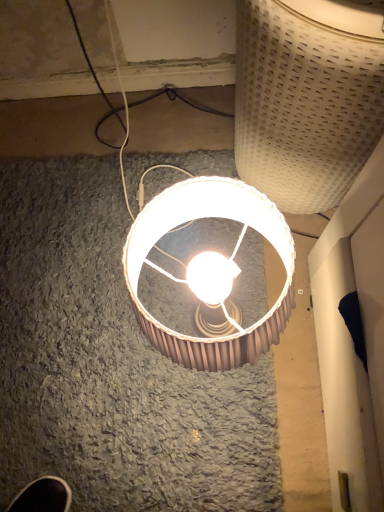
Question: Considering the positions of white woven basket at upper right, positioned as the first lamp in top-to-bottom order, and matte brown lampshade at center, the 2th lamp when ordered from top to bottom, in the image, is white woven basket at upper right, positioned as the first lamp in top-to-bottom order, wider or thinner than matte brown lampshade at center, the 2th lamp when ordered from top to bottom,?

Choices:
 (A) thin
 (B) wide

Answer: (B)

Question: In terms of size, does white woven basket at upper right, positioned as the first lamp in top-to-bottom order, appear bigger or smaller than matte brown lampshade at center, the 2th lamp when ordered from top to bottom?

Choices:
 (A) small
 (B) big

Answer: (B)

Question: Does point (276, 36) appear closer or farther from the camera than point (238, 355)?

Choices:
 (A) closer
 (B) farther

Answer: (B)

Question: Is matte brown lampshade at center, positioned as the first lamp in bottom-to-top order, in front of or behind white woven basket at upper right, arranged as the second lamp when ordered from the bottom, in the image?

Choices:
 (A) behind
 (B) front

Answer: (A)

Question: Looking at the image, does matte brown lampshade at center, the 2th lamp when ordered from top to bottom, seem bigger or smaller compared to white woven basket at upper right, arranged as the second lamp when ordered from the bottom?

Choices:
 (A) small
 (B) big

Answer: (A)

Question: Does point (213, 180) appear closer or farther from the camera than point (258, 162)?

Choices:
 (A) farther
 (B) closer

Answer: (B)

Question: Considering the relative positions of matte brown lampshade at center, positioned as the first lamp in bottom-to-top order, and white woven basket at upper right, positioned as the first lamp in top-to-bottom order, in the image provided, is matte brown lampshade at center, positioned as the first lamp in bottom-to-top order, to the left or to the right of white woven basket at upper right, positioned as the first lamp in top-to-bottom order,?

Choices:
 (A) left
 (B) right

Answer: (A)